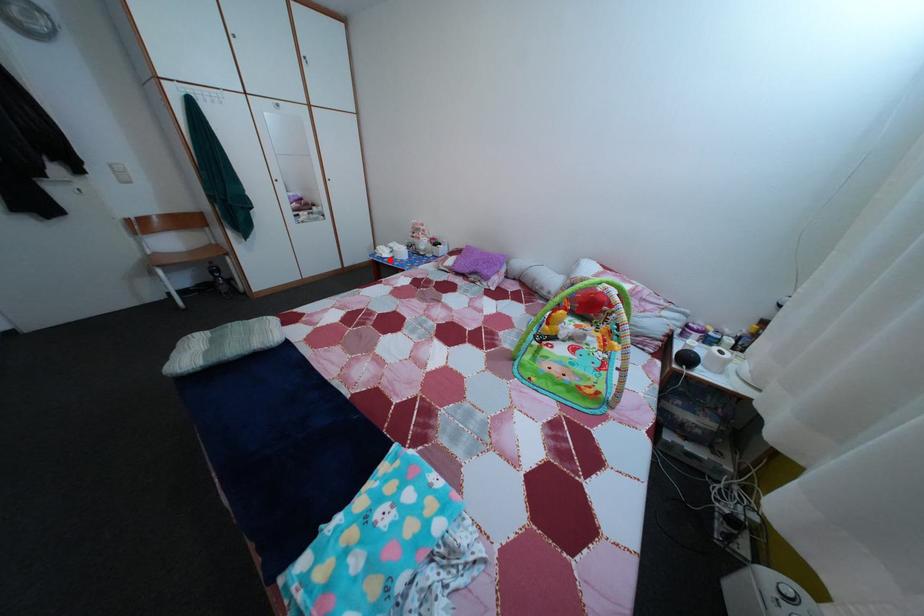
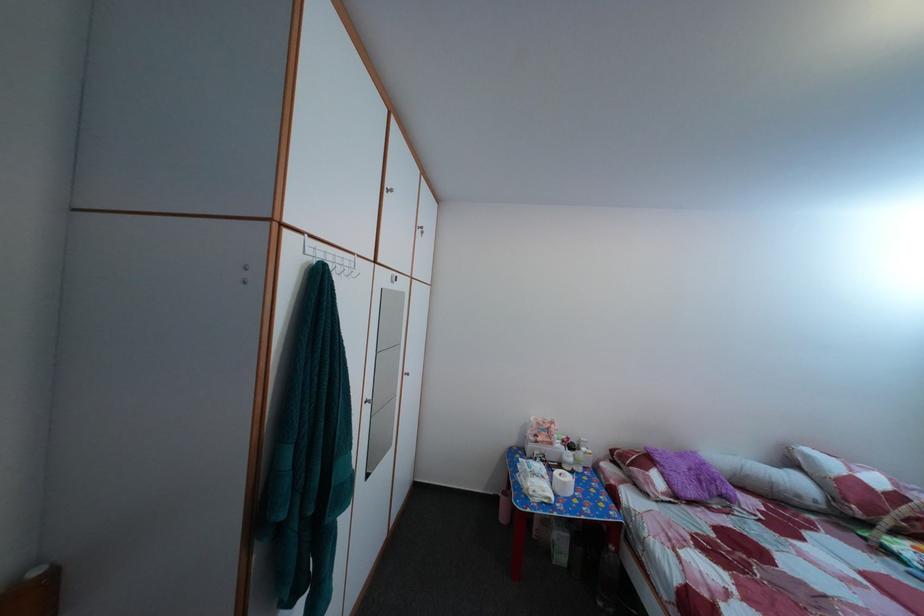
Where in the second image is the point corresponding to the highlighted location from the first image?

(551, 500)